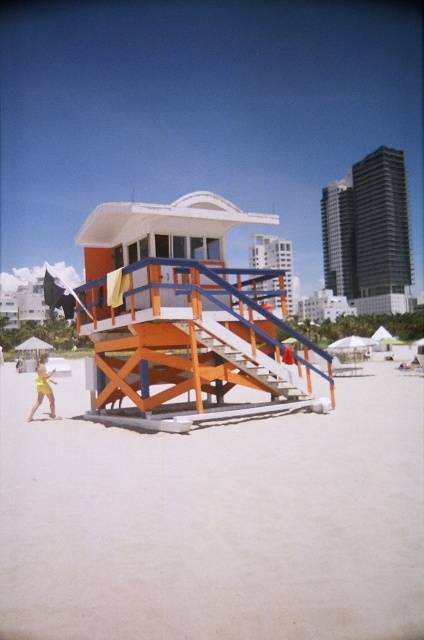
Is beige sandy beach at center to the right of yellow matte swimsuit at lower left from the viewer's perspective?

Indeed, beige sandy beach at center is positioned on the right side of yellow matte swimsuit at lower left.

The width and height of the screenshot is (424, 640). I want to click on beige sandy beach at center, so click(214, 522).

Is orange wood lifeguard tower at center above yellow matte swimsuit at lower left?

Yes.

Between point (89, 259) and point (45, 362), which one is positioned in front?

Point (89, 259) is in front.

Is point (150, 221) farther from viewer compared to point (38, 394)?

No.

You are a GUI agent. You are given a task and a screenshot of the screen. Output one action in this format:
    pyautogui.click(x=<x>, y=<y>)
    Task: Click on the orange wood lifeguard tower at center
    
    Given the screenshot: What is the action you would take?
    pyautogui.click(x=184, y=316)

Which of these two, beige sandy beach at center or orange wooden stairs at center, stands taller?

With more height is orange wooden stairs at center.

Does beige sandy beach at center appear under orange wooden stairs at center?

Yes, beige sandy beach at center is below orange wooden stairs at center.

Who is more forward, (200, 515) or (304, 394)?

Positioned in front is point (200, 515).

Locate an element on the screen. The height and width of the screenshot is (640, 424). beige sandy beach at center is located at coordinates (214, 522).